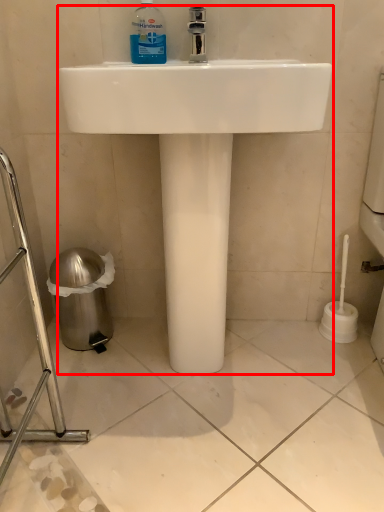
Question: Considering the relative positions of sink (annotated by the red box) and cleaning product in the image provided, where is sink (annotated by the red box) located with respect to the staircase?

Choices:
 (A) left
 (B) right

Answer: (B)